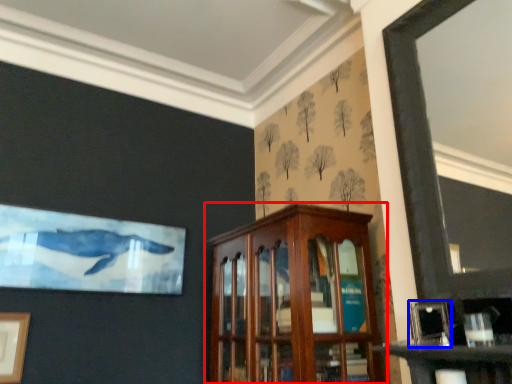
Question: Among these objects, which one is farthest to the camera, cabinetry (highlighted by a red box) or picture frame (highlighted by a blue box)?

Choices:
 (A) cabinetry
 (B) picture frame

Answer: (A)